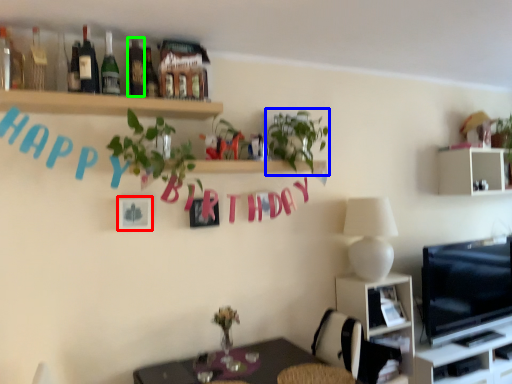
Question: Which object is the farthest from picture frame (highlighted by a red box)? Choose among these: plant (highlighted by a blue box) or bottle (highlighted by a green box).

Choices:
 (A) plant
 (B) bottle

Answer: (A)